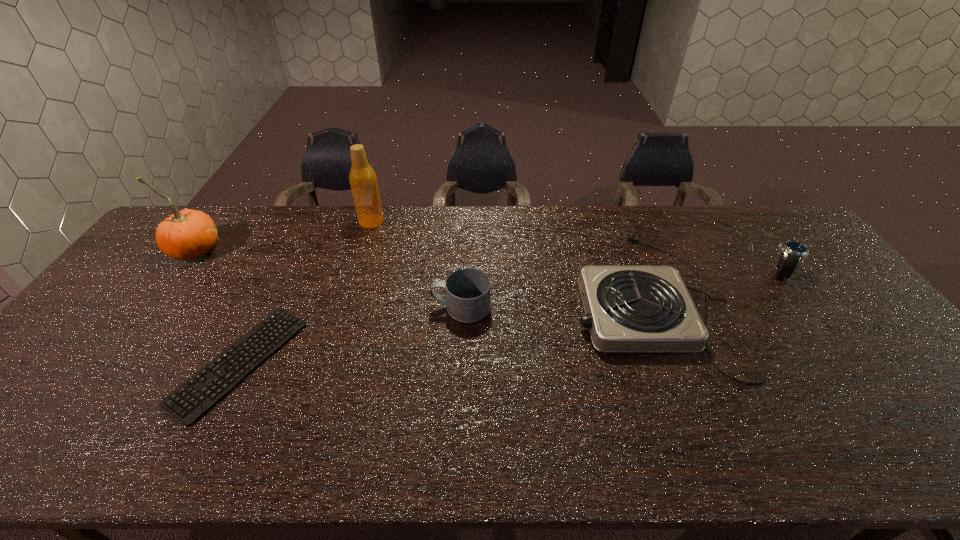
At what (x,y) coordinates should I click in order to perform the action: click on vacant space that's between the fourth object from left to right and the beer bottle. Please return your answer as a coordinate pair (x, y). The image size is (960, 540). Looking at the image, I should click on (417, 265).

Where is `free spot between the second object from right to left and the fourth object from left to right`? The width and height of the screenshot is (960, 540). free spot between the second object from right to left and the fourth object from left to right is located at coordinates (555, 303).

The width and height of the screenshot is (960, 540). What are the coordinates of `free space between the pumpkin and the fifth tallest object` in the screenshot? It's located at (421, 274).

Locate an element on the screen. This screenshot has height=540, width=960. unoccupied area between the second object from right to left and the pumpkin is located at coordinates (421, 274).

Locate an element on the screen. This screenshot has width=960, height=540. blank region between the mug and the shortest object is located at coordinates (350, 335).

Image resolution: width=960 pixels, height=540 pixels. I want to click on blank region between the leftmost object and the mug, so click(328, 279).

The height and width of the screenshot is (540, 960). What are the coordinates of `free space between the mug and the leftmost object` in the screenshot? It's located at (328, 279).

Identify the location of free spot between the leftmost object and the second object from right to left. The width and height of the screenshot is (960, 540). (421, 274).

Locate an element on the screen. unoccupied area between the computer keyboard and the fifth tallest object is located at coordinates (444, 330).

I want to click on object that ranks as the fifth closest to the computer keyboard, so click(x=793, y=252).